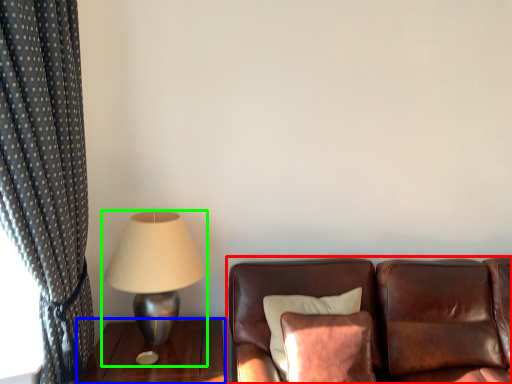
Question: Which object is the closest to the studio couch (highlighted by a red box)? Choose among these: table (highlighted by a blue box) or lamp (highlighted by a green box).

Choices:
 (A) table
 (B) lamp

Answer: (A)